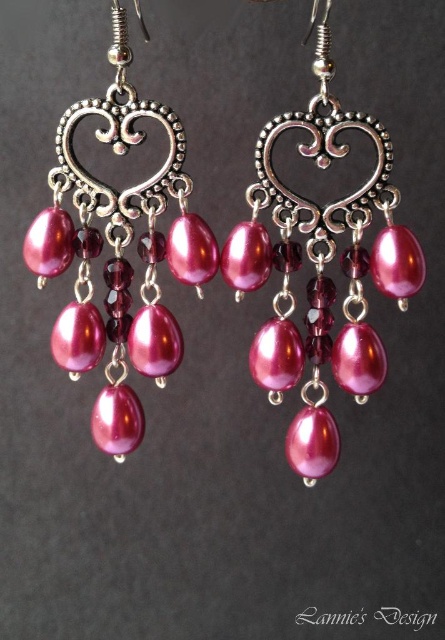
Question: Is pink pearl earrings at center above pearl-like pink earrings at center?

Choices:
 (A) yes
 (B) no

Answer: (B)

Question: Is the position of pink pearl earrings at center less distant than that of pearl-like pink earrings at center?

Choices:
 (A) no
 (B) yes

Answer: (B)

Question: Among these objects, which one is nearest to the camera?

Choices:
 (A) pearl-like pink earrings at center
 (B) pink pearl earrings at center

Answer: (B)

Question: Which of the following is the closest to the observer?

Choices:
 (A) pearl-like pink earrings at center
 (B) pink pearl earrings at center

Answer: (B)

Question: Can you confirm if pink pearl earrings at center is positioned to the left of pearl-like pink earrings at center?

Choices:
 (A) no
 (B) yes

Answer: (A)